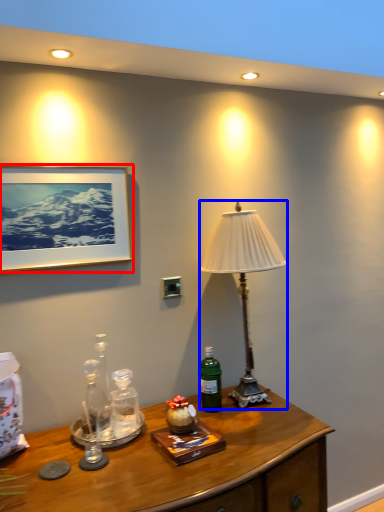
Question: Which object appears closest to the camera in this image, picture frame (highlighted by a red box) or lamp (highlighted by a blue box)?

Choices:
 (A) picture frame
 (B) lamp

Answer: (A)